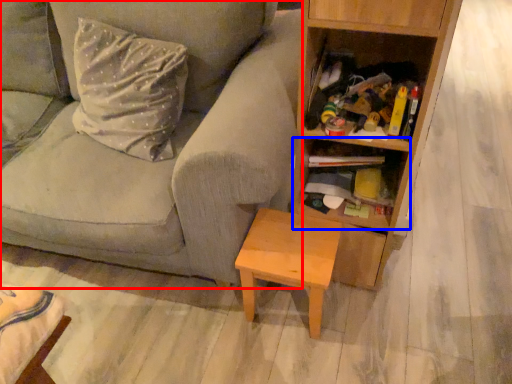
Question: Which object appears closest to the camera in this image, studio couch (highlighted by a red box) or shelf (highlighted by a blue box)?

Choices:
 (A) studio couch
 (B) shelf

Answer: (A)